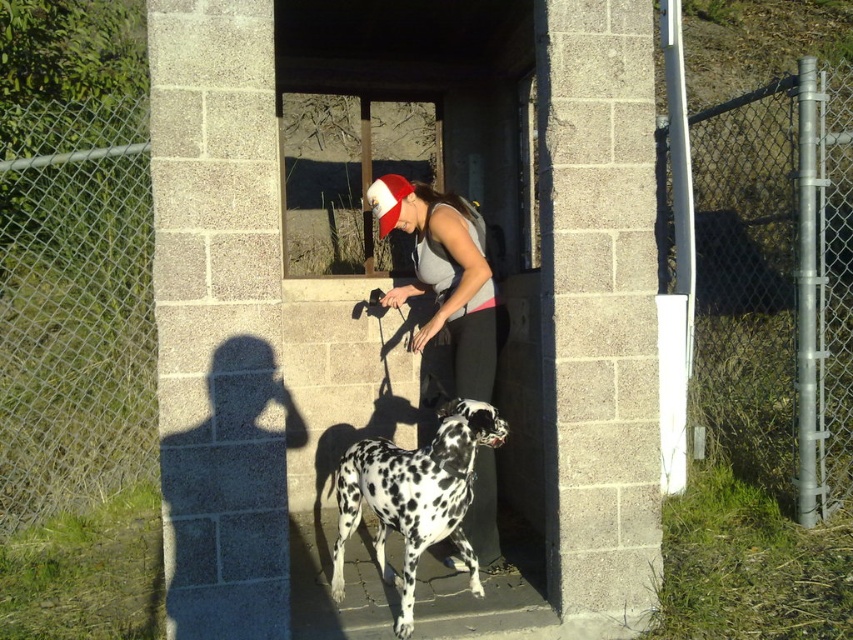
Between white-spotted fur dog at center and red fabric christmas hat at center, which one has less height?

red fabric christmas hat at center

Who is taller, white-spotted fur dog at center or red fabric christmas hat at center?

With more height is white-spotted fur dog at center.

Who is more forward, [448,497] or [392,227]?

Positioned in front is point [448,497].

Identify the location of white-spotted fur dog at center. This screenshot has height=640, width=853. (415, 497).

Can you confirm if white-spotted fur dog at center is shorter than matte gray tank top at center?

Correct, white-spotted fur dog at center is not as tall as matte gray tank top at center.

Is point (447, 497) in front of point (437, 198)?

Yes, it is.

I want to click on white-spotted fur dog at center, so click(x=415, y=497).

Is metal chain-link fence at left positioned behind matte gray tank top at center?

Yes, it is behind matte gray tank top at center.

Is point (126, 420) more distant than point (473, 308)?

Yes.

Where is `metal chain-link fence at left`? metal chain-link fence at left is located at coordinates (73, 304).